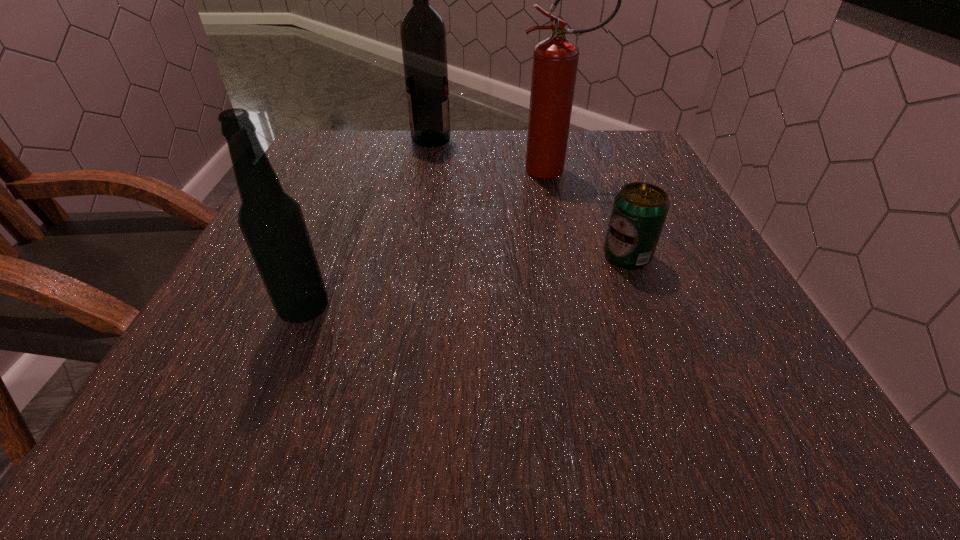
Identify the location of vacant position at the near edge of the desktop. This screenshot has width=960, height=540. coord(276,422).

In the image, there is a desktop. At what (x,y) coordinates should I click in order to perform the action: click on vacant region at the left edge. Please return your answer as a coordinate pair (x, y). The width and height of the screenshot is (960, 540). Looking at the image, I should click on (306, 186).

Locate an element on the screen. vacant space at the right edge of the desktop is located at coordinates (663, 312).

Find the location of a particular element. vacant space at the far left corner of the desktop is located at coordinates (354, 137).

In the image, there is a desktop. Find the location of `vacant region at the near left corner`. vacant region at the near left corner is located at coordinates (249, 420).

You are a GUI agent. You are given a task and a screenshot of the screen. Output one action in this format:
    pyautogui.click(x=<x>, y=<y>)
    Task: Click on the vacant space at the far right corner
    The height and width of the screenshot is (540, 960).
    Given the screenshot: What is the action you would take?
    pyautogui.click(x=636, y=151)

At what (x,y) coordinates should I click in order to perform the action: click on vacant region at the near right corner. Please return your answer as a coordinate pair (x, y). The image size is (960, 540). Looking at the image, I should click on (725, 413).

Locate an element on the screen. The width and height of the screenshot is (960, 540). empty space between the beer can and the fire extinguisher is located at coordinates (590, 213).

This screenshot has width=960, height=540. I want to click on vacant point located between the beer can and the right alcohol, so click(529, 198).

The width and height of the screenshot is (960, 540). I want to click on empty space that is in between the nearer alcohol and the taller alcohol, so click(x=368, y=225).